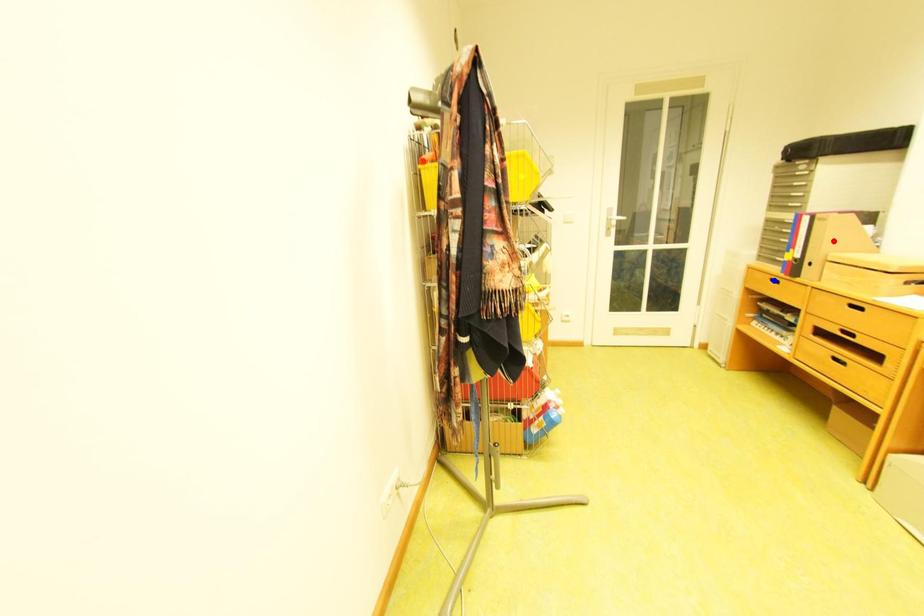
Order these from nearest to farthest:
yellow point
red point
blue point

blue point < red point < yellow point